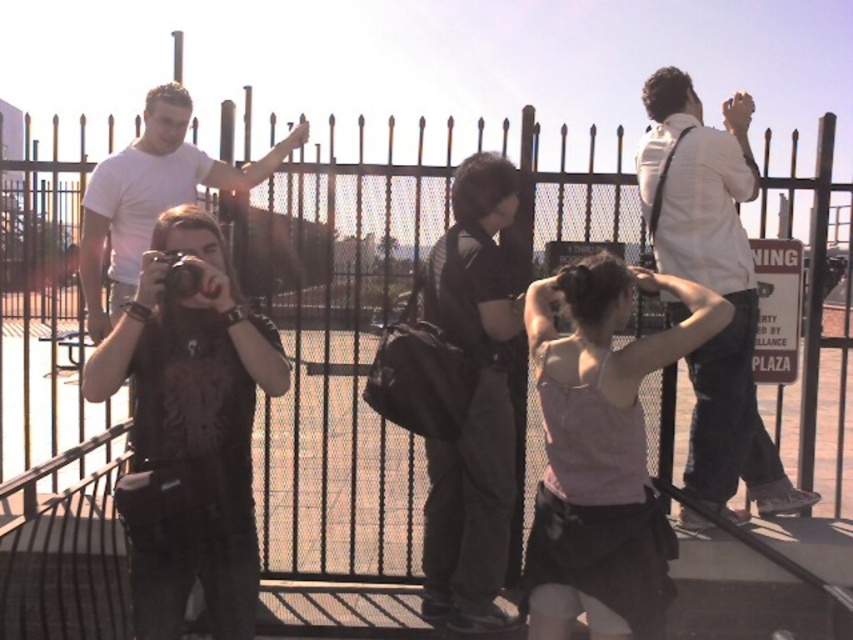
Is matte black shirt at center to the left of white matte t-shirt at upper left from the viewer's perspective?

In fact, matte black shirt at center is to the right of white matte t-shirt at upper left.

Is matte black shirt at center below white matte t-shirt at upper left?

Correct, matte black shirt at center is located below white matte t-shirt at upper left.

Find the location of a particular element. matte black shirt at center is located at coordinates (189, 433).

Does point (480, 196) lie behind point (177, 298)?

Yes, it is.

Is the position of black matte backpack at center more distant than that of matte black camera at center?

Yes, it is.

Identify the location of black matte backpack at center. Image resolution: width=853 pixels, height=640 pixels. (473, 404).

Can you confirm if black matte backpack at center is smaller than white matte t-shirt at upper left?

Indeed, black matte backpack at center has a smaller size compared to white matte t-shirt at upper left.

Is black matte backpack at center closer to the viewer compared to white matte t-shirt at upper left?

Yes, black matte backpack at center is in front of white matte t-shirt at upper left.

Is point (453, 256) behind point (184, 131)?

No, (453, 256) is closer to viewer.

You are a GUI agent. You are given a task and a screenshot of the screen. Output one action in this format:
    pyautogui.click(x=<x>, y=<y>)
    Task: Click on the black matte backpack at center
    This screenshot has height=640, width=853.
    Given the screenshot: What is the action you would take?
    pyautogui.click(x=473, y=404)